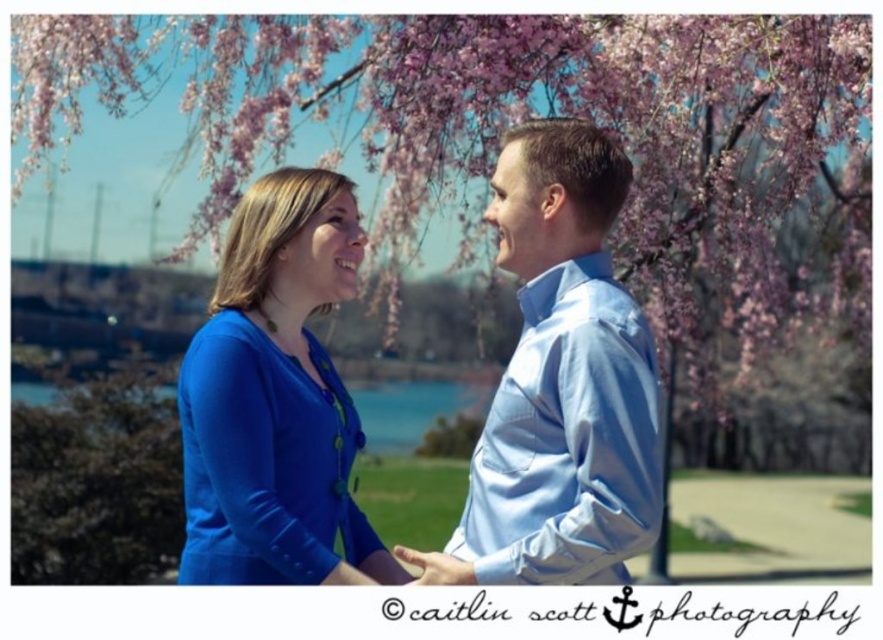
Is light blue satin shirt at center wider than matte blue blouse at center?

In fact, light blue satin shirt at center might be narrower than matte blue blouse at center.

Is light blue satin shirt at center to the right of matte blue blouse at center from the viewer's perspective?

Yes, light blue satin shirt at center is to the right of matte blue blouse at center.

Is point (598, 179) closer to camera compared to point (405, 577)?

Yes.

At what (x,y) coordinates should I click in order to perform the action: click on light blue satin shirt at center. Please return your answer as a coordinate pair (x, y). Image resolution: width=883 pixels, height=640 pixels. Looking at the image, I should click on (564, 376).

Does point (72, 403) come closer to viewer compared to point (408, 554)?

No, it is behind (408, 554).

Which is more to the right, green leafy tree at left or matte blue shirt at center?

matte blue shirt at center is more to the right.

Is point (50, 458) positioned before point (448, 557)?

No.

Where is `green leafy tree at left`? This screenshot has width=883, height=640. green leafy tree at left is located at coordinates (97, 481).

Image resolution: width=883 pixels, height=640 pixels. What do you see at coordinates (514, 122) in the screenshot?
I see `pink silky flower at upper center` at bounding box center [514, 122].

Is pink silky flower at upper center to the left of matte blue blouse at center from the viewer's perspective?

Incorrect, pink silky flower at upper center is not on the left side of matte blue blouse at center.

Locate an element on the screen. pink silky flower at upper center is located at coordinates (514, 122).

You are a GUI agent. You are given a task and a screenshot of the screen. Output one action in this format:
    pyautogui.click(x=<x>, y=<y>)
    Task: Click on the pink silky flower at upper center
    
    Given the screenshot: What is the action you would take?
    pyautogui.click(x=514, y=122)